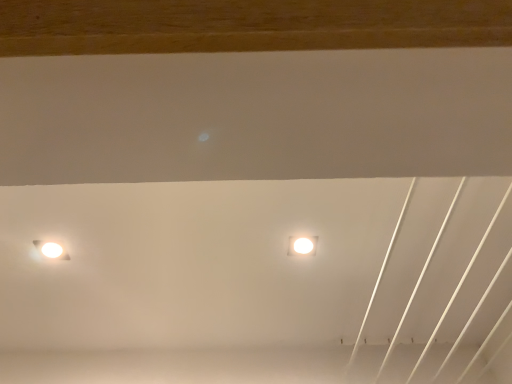
What is the approximate width of white glossy lamp at left, marked as the 2th lamp in a right-to-left arrangement?

white glossy lamp at left, marked as the 2th lamp in a right-to-left arrangement, is 3.72 inches in width.

Image resolution: width=512 pixels, height=384 pixels. Identify the location of white glossy lamp at left, marked as the 2th lamp in a right-to-left arrangement. (51, 250).

What do you see at coordinates (51, 250) in the screenshot? I see `white glossy lamp at left, which is the first lamp from left to right` at bounding box center [51, 250].

What is the approximate height of white glossy lamp at left, marked as the 2th lamp in a right-to-left arrangement?

white glossy lamp at left, marked as the 2th lamp in a right-to-left arrangement, is 2.72 centimeters tall.

Measure the distance between white glossy lamp at upper center, the 1th lamp in the right-to-left sequence, and camera.

white glossy lamp at upper center, the 1th lamp in the right-to-left sequence, and camera are 1.31 meters apart from each other.

The height and width of the screenshot is (384, 512). What do you see at coordinates (302, 245) in the screenshot? I see `white glossy lamp at upper center, the 1th lamp in the right-to-left sequence` at bounding box center [302, 245].

In order to face white glossy lamp at upper center, the 1th lamp in the right-to-left sequence, should I rotate leftwards or rightwards?

You should rotate right by 6.611 degrees.

Find the location of `white glossy lamp at upper center, placed as the 2th lamp when sorted from left to right`. white glossy lamp at upper center, placed as the 2th lamp when sorted from left to right is located at coordinates pyautogui.click(x=302, y=245).

This screenshot has width=512, height=384. I want to click on white glossy lamp at left, which is the first lamp from left to right, so click(x=51, y=250).

Is white glossy lamp at upper center, the 1th lamp in the right-to-left sequence, to the right of white glossy lamp at left, which is the first lamp from left to right, from the viewer's perspective?

Correct, you'll find white glossy lamp at upper center, the 1th lamp in the right-to-left sequence, to the right of white glossy lamp at left, which is the first lamp from left to right.

Relative to white glossy lamp at left, which is the first lamp from left to right, is white glossy lamp at upper center, the 1th lamp in the right-to-left sequence, in front or behind?

white glossy lamp at upper center, the 1th lamp in the right-to-left sequence, is behind white glossy lamp at left, which is the first lamp from left to right.

Does point (293, 239) lie behind point (54, 256)?

No.

From the image's perspective, is white glossy lamp at upper center, the 1th lamp in the right-to-left sequence, on top of white glossy lamp at left, which is the first lamp from left to right?

Correct, white glossy lamp at upper center, the 1th lamp in the right-to-left sequence, appears higher than white glossy lamp at left, which is the first lamp from left to right, in the image.

From a real-world perspective, is white glossy lamp at upper center, placed as the 2th lamp when sorted from left to right, below white glossy lamp at left, marked as the 2th lamp in a right-to-left arrangement?

Yes, from a real-world perspective, white glossy lamp at upper center, placed as the 2th lamp when sorted from left to right, is beneath white glossy lamp at left, marked as the 2th lamp in a right-to-left arrangement.

Based on the photo, considering the relative sizes of white glossy lamp at upper center, placed as the 2th lamp when sorted from left to right, and white glossy lamp at left, marked as the 2th lamp in a right-to-left arrangement, in the image provided, is white glossy lamp at upper center, placed as the 2th lamp when sorted from left to right, wider than white glossy lamp at left, marked as the 2th lamp in a right-to-left arrangement,?

Correct, the width of white glossy lamp at upper center, placed as the 2th lamp when sorted from left to right, exceeds that of white glossy lamp at left, marked as the 2th lamp in a right-to-left arrangement.

Can you confirm if white glossy lamp at upper center, the 1th lamp in the right-to-left sequence, is shorter than white glossy lamp at left, marked as the 2th lamp in a right-to-left arrangement?

Correct, white glossy lamp at upper center, the 1th lamp in the right-to-left sequence, is not as tall as white glossy lamp at left, marked as the 2th lamp in a right-to-left arrangement.

Considering the relative sizes of white glossy lamp at upper center, the 1th lamp in the right-to-left sequence, and white glossy lamp at left, which is the first lamp from left to right, in the image provided, is white glossy lamp at upper center, the 1th lamp in the right-to-left sequence, smaller than white glossy lamp at left, which is the first lamp from left to right,?

Yes, white glossy lamp at upper center, the 1th lamp in the right-to-left sequence, is smaller than white glossy lamp at left, which is the first lamp from left to right.

Choose the correct answer: Is white glossy lamp at upper center, the 1th lamp in the right-to-left sequence, inside white glossy lamp at left, marked as the 2th lamp in a right-to-left arrangement, or outside it?

white glossy lamp at upper center, the 1th lamp in the right-to-left sequence, is not enclosed by white glossy lamp at left, marked as the 2th lamp in a right-to-left arrangement.

Is white glossy lamp at upper center, placed as the 2th lamp when sorted from left to right, far from white glossy lamp at left, marked as the 2th lamp in a right-to-left arrangement?

white glossy lamp at upper center, placed as the 2th lamp when sorted from left to right, is actually quite close to white glossy lamp at left, marked as the 2th lamp in a right-to-left arrangement.

Is white glossy lamp at upper center, the 1th lamp in the right-to-left sequence, facing away from white glossy lamp at left, marked as the 2th lamp in a right-to-left arrangement?

No, white glossy lamp at left, marked as the 2th lamp in a right-to-left arrangement, is not at the back of white glossy lamp at upper center, the 1th lamp in the right-to-left sequence.

What's the angular difference between white glossy lamp at upper center, placed as the 2th lamp when sorted from left to right, and white glossy lamp at left, which is the first lamp from left to right,'s facing directions?

The angle between the facing direction of white glossy lamp at upper center, placed as the 2th lamp when sorted from left to right, and the facing direction of white glossy lamp at left, which is the first lamp from left to right, is 179 degrees.

Could you measure the distance between white glossy lamp at upper center, placed as the 2th lamp when sorted from left to right, and white glossy lamp at left, which is the first lamp from left to right?

white glossy lamp at upper center, placed as the 2th lamp when sorted from left to right, and white glossy lamp at left, which is the first lamp from left to right, are 29.18 inches apart from each other.

At what (x,y) coordinates should I click in order to perform the action: click on lamp below the white glossy lamp at left, which is the first lamp from left to right (from a real-world perspective). Please return your answer as a coordinate pair (x, y). Looking at the image, I should click on (302, 245).

Can you confirm if white glossy lamp at left, marked as the 2th lamp in a right-to-left arrangement, is positioned to the right of white glossy lamp at upper center, the 1th lamp in the right-to-left sequence?

No.

Is the depth of white glossy lamp at left, which is the first lamp from left to right, less than that of white glossy lamp at upper center, placed as the 2th lamp when sorted from left to right?

Yes, it is.

Is point (53, 244) farther from viewer compared to point (307, 242)?

No, it is in front of (307, 242).

From the image's perspective, relative to white glossy lamp at upper center, placed as the 2th lamp when sorted from left to right, is white glossy lamp at left, marked as the 2th lamp in a right-to-left arrangement, above or below?

Clearly, from the image's perspective, white glossy lamp at left, marked as the 2th lamp in a right-to-left arrangement, is below white glossy lamp at upper center, placed as the 2th lamp when sorted from left to right.

From a real-world perspective, is white glossy lamp at left, which is the first lamp from left to right, over white glossy lamp at upper center, placed as the 2th lamp when sorted from left to right?

Yes.

In terms of width, does white glossy lamp at left, marked as the 2th lamp in a right-to-left arrangement, look wider or thinner when compared to white glossy lamp at upper center, the 1th lamp in the right-to-left sequence?

Clearly, white glossy lamp at left, marked as the 2th lamp in a right-to-left arrangement, has less width compared to white glossy lamp at upper center, the 1th lamp in the right-to-left sequence.

Consider the image. Considering the relative sizes of white glossy lamp at left, marked as the 2th lamp in a right-to-left arrangement, and white glossy lamp at upper center, the 1th lamp in the right-to-left sequence, in the image provided, is white glossy lamp at left, marked as the 2th lamp in a right-to-left arrangement, shorter than white glossy lamp at upper center, the 1th lamp in the right-to-left sequence,?

No.

Consider the image. Which of these two, white glossy lamp at left, which is the first lamp from left to right, or white glossy lamp at upper center, placed as the 2th lamp when sorted from left to right, is bigger?

With larger size is white glossy lamp at left, which is the first lamp from left to right.

Is white glossy lamp at left, which is the first lamp from left to right, completely or partially outside of white glossy lamp at upper center, the 1th lamp in the right-to-left sequence?

Indeed, white glossy lamp at left, which is the first lamp from left to right, is completely outside white glossy lamp at upper center, the 1th lamp in the right-to-left sequence.

Would you consider white glossy lamp at left, marked as the 2th lamp in a right-to-left arrangement, to be distant from white glossy lamp at upper center, placed as the 2th lamp when sorted from left to right?

No, white glossy lamp at left, marked as the 2th lamp in a right-to-left arrangement, is in close proximity to white glossy lamp at upper center, placed as the 2th lamp when sorted from left to right.

Is white glossy lamp at left, marked as the 2th lamp in a right-to-left arrangement, facing towards white glossy lamp at upper center, placed as the 2th lamp when sorted from left to right?

Yes, white glossy lamp at left, marked as the 2th lamp in a right-to-left arrangement, is turned towards white glossy lamp at upper center, placed as the 2th lamp when sorted from left to right.

You are a GUI agent. You are given a task and a screenshot of the screen. Output one action in this format:
    pyautogui.click(x=<x>, y=<y>)
    Task: Click on the lamp directly beneath the white glossy lamp at left, which is the first lamp from left to right (from a real-world perspective)
    
    Given the screenshot: What is the action you would take?
    pyautogui.click(x=302, y=245)

Locate an element on the screen. This screenshot has height=384, width=512. lamp located on the left of white glossy lamp at upper center, the 1th lamp in the right-to-left sequence is located at coordinates [x=51, y=250].

The width and height of the screenshot is (512, 384). I want to click on lamp located on the right of white glossy lamp at left, marked as the 2th lamp in a right-to-left arrangement, so click(x=302, y=245).